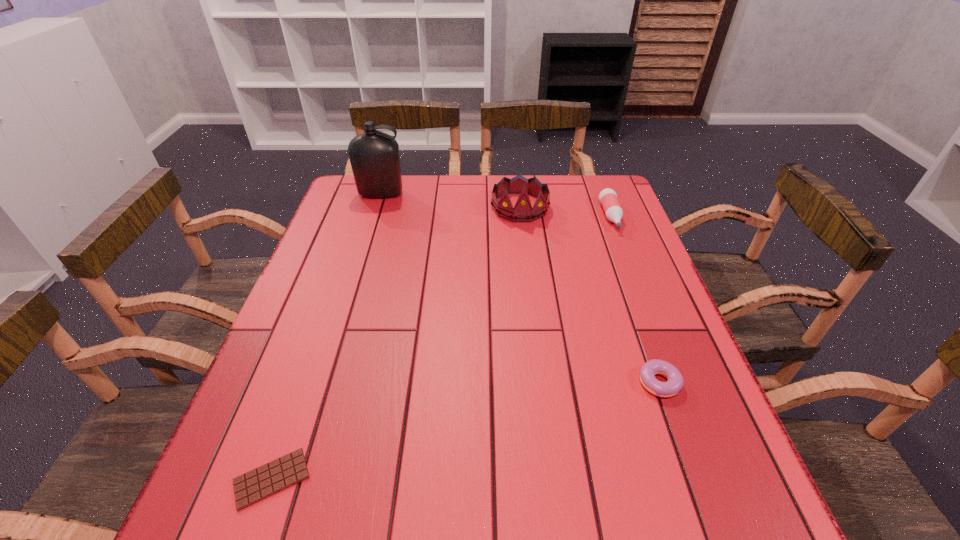
You are a GUI agent. You are given a task and a screenshot of the screen. Output one action in this format:
    pyautogui.click(x=<x>, y=<y>)
    Task: Click on the doughnut present at the right edge
    Image resolution: width=960 pixels, height=540 pixels.
    Given the screenshot: What is the action you would take?
    pyautogui.click(x=675, y=382)

Where is `object that is at the far left corner`? The width and height of the screenshot is (960, 540). object that is at the far left corner is located at coordinates (374, 156).

The image size is (960, 540). In order to click on object at the near left corner in this screenshot , I will do `click(260, 483)`.

This screenshot has height=540, width=960. In order to click on object at the far right corner in this screenshot , I will do `click(608, 198)`.

I want to click on free region at the far edge of the desktop, so click(x=548, y=210).

The image size is (960, 540). Find the location of `vacant area at the near edge of the desktop`. vacant area at the near edge of the desktop is located at coordinates (444, 503).

This screenshot has height=540, width=960. In order to click on vacant space at the left edge in this screenshot , I will do `click(348, 219)`.

Where is `vacant region at the right edge`? The width and height of the screenshot is (960, 540). vacant region at the right edge is located at coordinates (662, 460).

Locate an element on the screen. free space between the shortest object and the doughnut is located at coordinates (466, 431).

This screenshot has height=540, width=960. I want to click on vacant space that's between the tallest object and the doughnut, so coord(519,289).